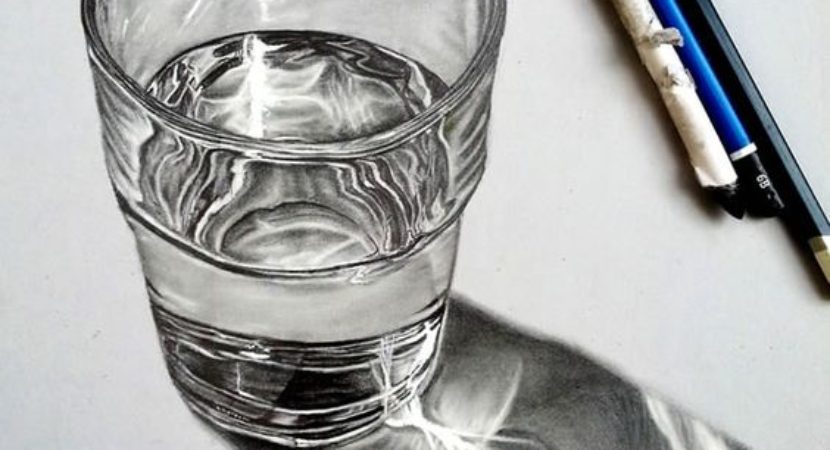
This screenshot has width=830, height=450. In order to click on pen in this screenshot , I will do `click(798, 185)`.